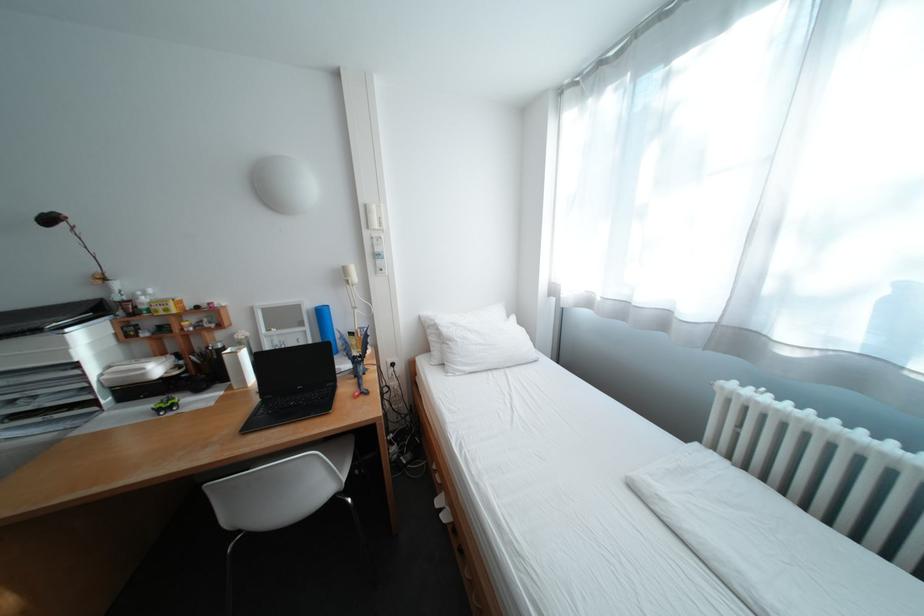
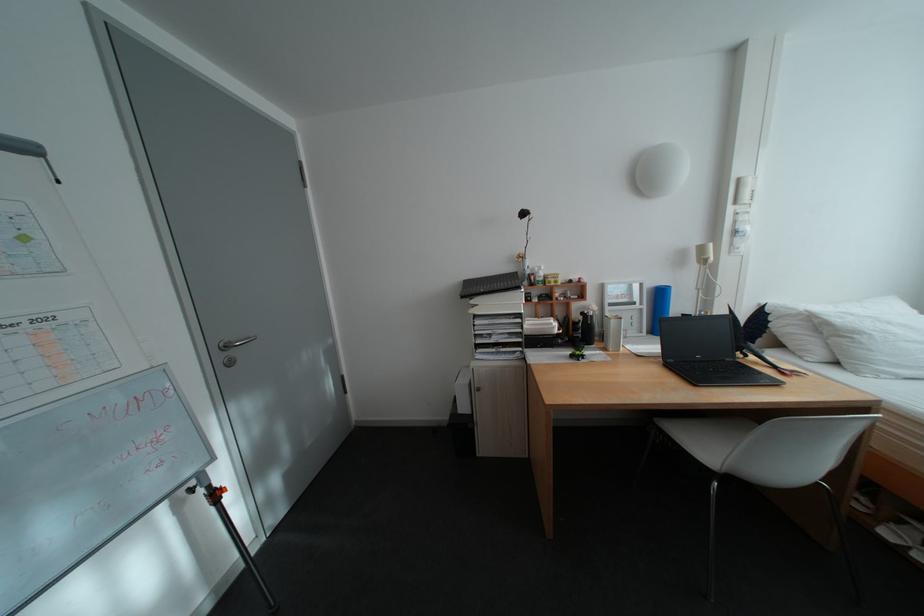
Question: What movement of the cameraman would produce the second image?

Choices:
 (A) Left
 (B) Right
 (C) Forward
 (D) Backward

Answer: (A)